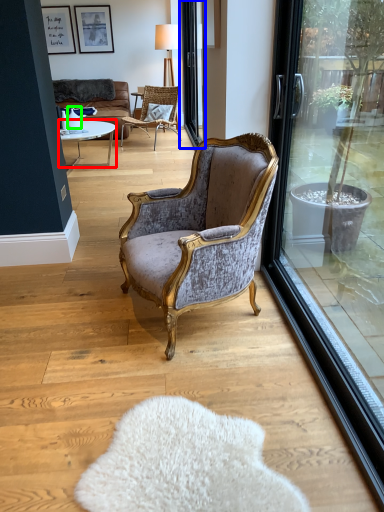
Question: Which object is positioned closest to coffee table (highlighted by a red box)? Select from screen door (highlighted by a blue box) and vase (highlighted by a green box).

Choices:
 (A) screen door
 (B) vase

Answer: (B)